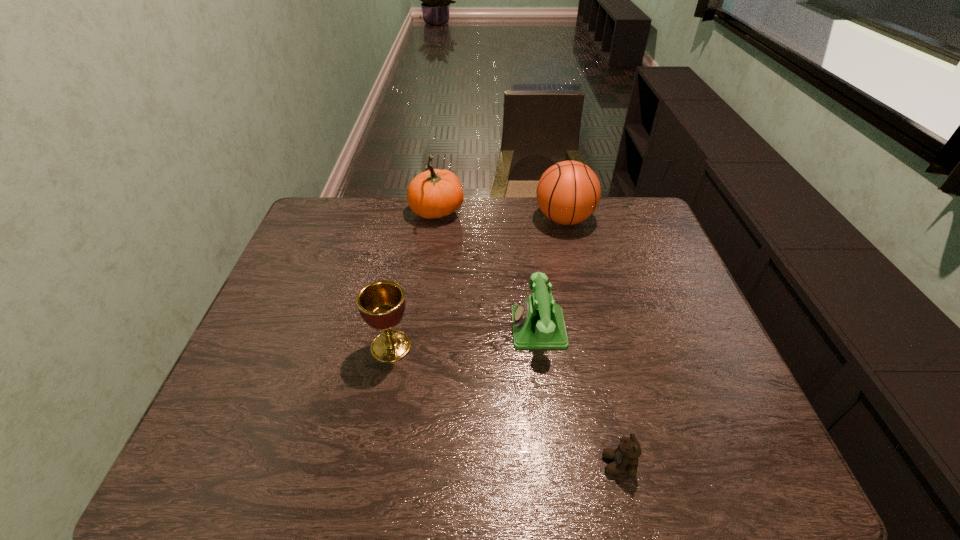
Find the location of a particular element. The image size is (960, 540). the tallest object is located at coordinates click(x=435, y=193).

You are a GUI agent. You are given a task and a screenshot of the screen. Output one action in this format:
    pyautogui.click(x=<x>, y=<y>)
    Task: Click on the basketball
    
    Given the screenshot: What is the action you would take?
    pyautogui.click(x=568, y=192)

The width and height of the screenshot is (960, 540). Find the location of `the third tallest object`. the third tallest object is located at coordinates (381, 304).

Where is `telephone`? The width and height of the screenshot is (960, 540). telephone is located at coordinates (538, 323).

This screenshot has height=540, width=960. I want to click on teddy bear, so click(625, 457).

The height and width of the screenshot is (540, 960). I want to click on the nearest object, so click(x=625, y=457).

Find the location of a particular element. The height and width of the screenshot is (540, 960). free space located on the left of the tallest object is located at coordinates (328, 213).

This screenshot has height=540, width=960. In order to click on vacant space located 0.240m on the left of the basketball in this screenshot , I will do `click(464, 219)`.

Where is `blank area located 0.210m on the front of the chalice`? This screenshot has height=540, width=960. blank area located 0.210m on the front of the chalice is located at coordinates (372, 448).

At what (x,y) coordinates should I click in order to perform the action: click on free location located on the dial of the second shortest object. Please return your answer as a coordinate pair (x, y). Image resolution: width=960 pixels, height=540 pixels. Looking at the image, I should click on (469, 328).